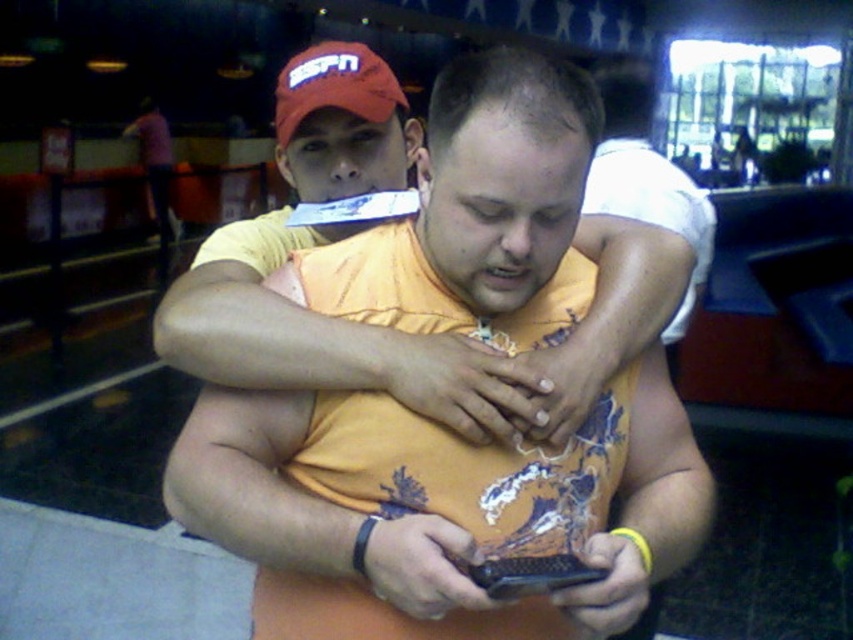
Question: Among these points, which one is nearest to the camera?

Choices:
 (A) pos(397,90)
 (B) pos(492,593)
 (C) pos(473,556)

Answer: (B)

Question: Among these objects, which one is nearest to the camera?

Choices:
 (A) red fabric cap at upper center
 (B) orange printed shirt at center
 (C) black textured phone at center

Answer: (C)

Question: Does red fabric cap at upper center come behind black textured phone at center?

Choices:
 (A) no
 (B) yes

Answer: (B)

Question: Where is orange printed shirt at center located in relation to red fabric cap at upper center in the image?

Choices:
 (A) right
 (B) left

Answer: (A)

Question: Which object appears closest to the camera in this image?

Choices:
 (A) orange printed shirt at center
 (B) black textured phone at center

Answer: (B)

Question: In this image, where is red fabric cap at upper center located relative to black textured phone at center?

Choices:
 (A) below
 (B) above

Answer: (B)